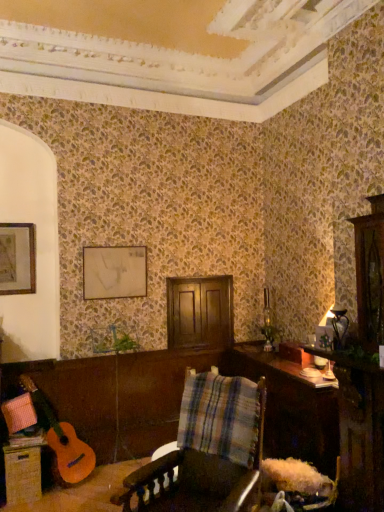
Question: Considering the relative sizes of woven wicker drawer at lower left and matte gold picture frame at upper left, positioned as the 2th picture frame in right-to-left order, in the image provided, is woven wicker drawer at lower left wider than matte gold picture frame at upper left, positioned as the 2th picture frame in right-to-left order,?

Choices:
 (A) yes
 (B) no

Answer: (A)

Question: Considering the relative sizes of woven wicker drawer at lower left and matte gold picture frame at upper left, arranged as the 1th picture frame when viewed from the front, in the image provided, is woven wicker drawer at lower left shorter than matte gold picture frame at upper left, arranged as the 1th picture frame when viewed from the front,?

Choices:
 (A) yes
 (B) no

Answer: (A)

Question: From a real-world perspective, is woven wicker drawer at lower left over matte gold picture frame at upper left, the first picture frame positioned from the left?

Choices:
 (A) no
 (B) yes

Answer: (A)

Question: Is woven wicker drawer at lower left positioned with its back to matte gold picture frame at upper left, the 2th picture frame positioned from the back?

Choices:
 (A) yes
 (B) no

Answer: (B)

Question: Does woven wicker drawer at lower left lie in front of matte gold picture frame at upper left, positioned as the 2th picture frame in right-to-left order?

Choices:
 (A) yes
 (B) no

Answer: (A)

Question: Does point (203, 419) appear closer or farther from the camera than point (246, 391)?

Choices:
 (A) closer
 (B) farther

Answer: (B)

Question: Is plaid fabric at center in front of or behind wooden plaid chair at center in the image?

Choices:
 (A) behind
 (B) front

Answer: (A)

Question: Considering the positions of plaid fabric at center and wooden plaid chair at center in the image, is plaid fabric at center wider or thinner than wooden plaid chair at center?

Choices:
 (A) wide
 (B) thin

Answer: (B)

Question: Visually, is plaid fabric at center positioned to the left or to the right of wooden plaid chair at center?

Choices:
 (A) right
 (B) left

Answer: (A)

Question: From their relative heights in the image, would you say matte gold picture frame at upper left, the 2th picture frame positioned from the back, is taller or shorter than wooden table at lower right?

Choices:
 (A) tall
 (B) short

Answer: (B)

Question: From a real-world perspective, is matte gold picture frame at upper left, the 2th picture frame positioned from the back, physically located above or below wooden table at lower right?

Choices:
 (A) above
 (B) below

Answer: (A)

Question: Relative to wooden table at lower right, is matte gold picture frame at upper left, positioned as the 2th picture frame in right-to-left order, in front or behind?

Choices:
 (A) behind
 (B) front

Answer: (A)

Question: Considering the positions of matte gold picture frame at upper left, the first picture frame positioned from the left, and wooden table at lower right in the image, is matte gold picture frame at upper left, the first picture frame positioned from the left, wider or thinner than wooden table at lower right?

Choices:
 (A) wide
 (B) thin

Answer: (B)

Question: From the image's perspective, is woven wicker drawer at lower left positioned above or below plaid fabric at center?

Choices:
 (A) above
 (B) below

Answer: (B)

Question: Considering the relative positions of woven wicker drawer at lower left and plaid fabric at center in the image provided, is woven wicker drawer at lower left to the left or to the right of plaid fabric at center?

Choices:
 (A) right
 (B) left

Answer: (B)